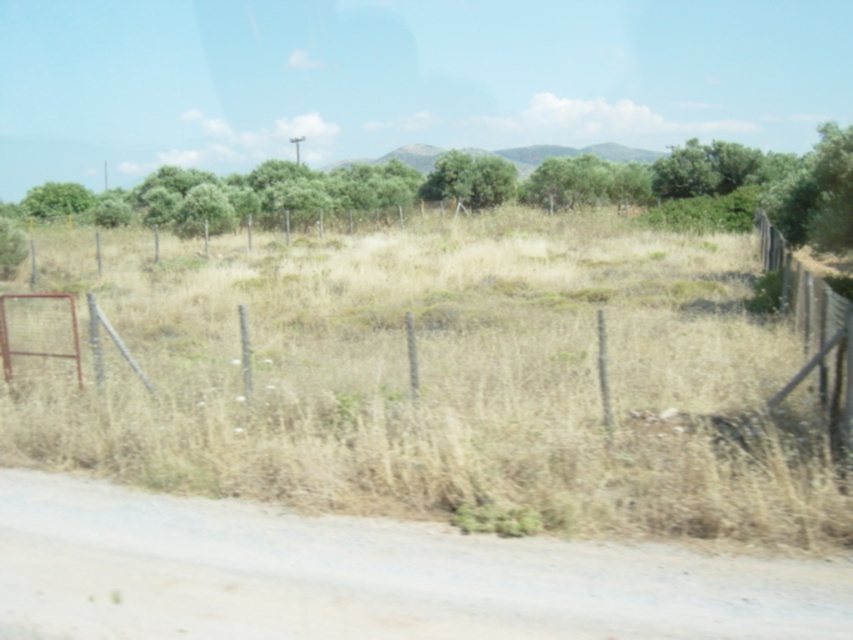
You are standing at the center of the image and want to walk to the brown dirt track at lower left. In which general direction should you head?

The brown dirt track at lower left is located at point (367, 576) in 2D coordinates, so you should head towards the lower left direction to reach it.

Consider the image. You are a hiker trying to navigate through the rural landscape shown. You need to decide whether to follow the brown dirt track at lower left or head towards the green leafy tree at upper center. Based on their sizes in the image, which path would likely be narrower or smaller in real life?

The brown dirt track at lower left occupies less space than the green leafy tree at upper center, so the brown dirt track at lower left is likely narrower in real life.

You are driving a car along the brown dirt track at lower left and want to reach the green leafy tree at center. Is the dirt track blocking your path to the tree?

The brown dirt track at lower left is in front of the green leafy tree at center, so the dirt track is not blocking your path to the tree. You can drive along the dirt track towards the tree.